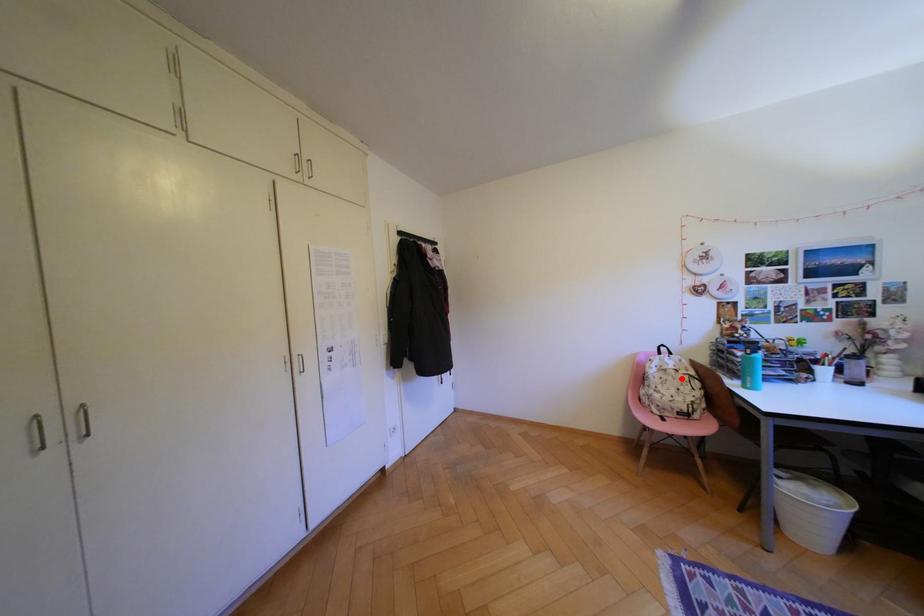
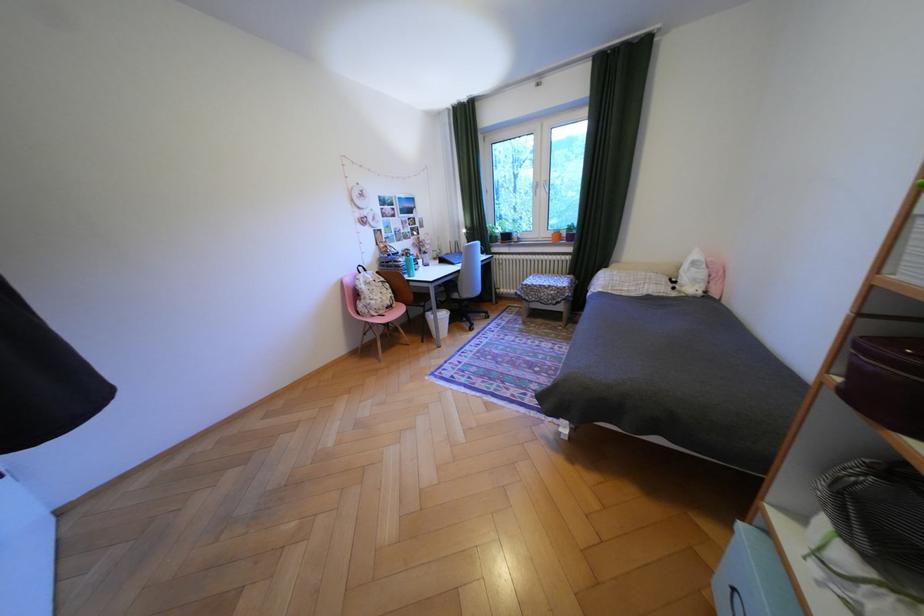
Find the pixel in the second image that matches the highlighted location in the first image.

(386, 288)